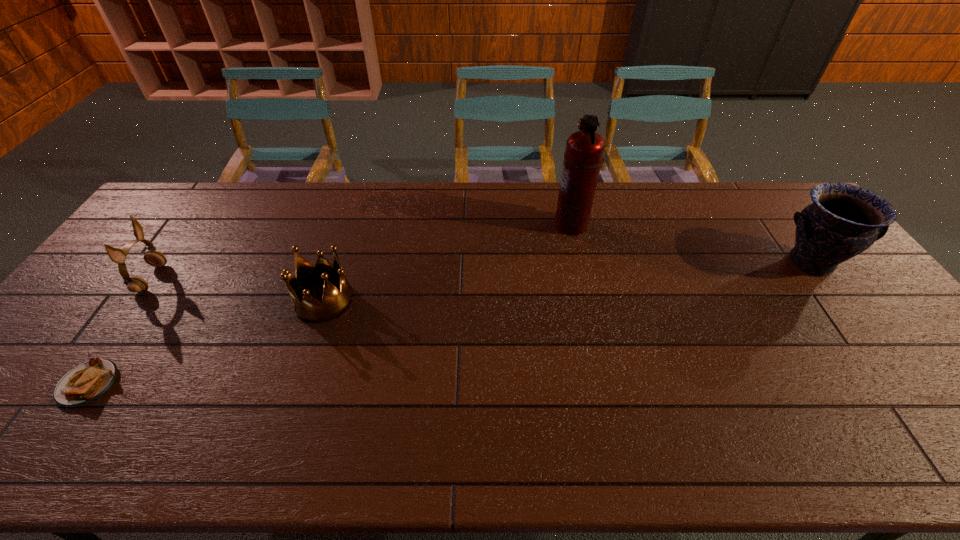
Identify the location of vacant space positioned 0.300m on the nozzle side of the fourth object from left to right. The height and width of the screenshot is (540, 960). (464, 225).

The height and width of the screenshot is (540, 960). What are the coordinates of `free location located 0.140m on the nozzle side of the fourth object from left to right` in the screenshot? It's located at (512, 225).

Locate an element on the screen. The height and width of the screenshot is (540, 960). vacant point located on the front handle of the pottery is located at coordinates (842, 305).

In order to click on vacant space located 0.090m on the front-facing side of the earphone in this screenshot , I will do `click(193, 278)`.

You are a GUI agent. You are given a task and a screenshot of the screen. Output one action in this format:
    pyautogui.click(x=<x>, y=<y>)
    Task: Click on the vacant space located on the front of the third object from left to right
    
    Given the screenshot: What is the action you would take?
    pyautogui.click(x=272, y=459)

What are the coordinates of `free space located on the back of the nearest object` in the screenshot? It's located at (145, 303).

At what (x,y) coordinates should I click in order to perform the action: click on object located in the far edge section of the desktop. Please return your answer as a coordinate pair (x, y). The width and height of the screenshot is (960, 540). Looking at the image, I should click on (583, 156).

Locate an element on the screen. This screenshot has width=960, height=540. earphone that is at the left edge is located at coordinates (135, 284).

Find the location of a particular element. The width and height of the screenshot is (960, 540). sandwich located at the left edge is located at coordinates (87, 382).

The image size is (960, 540). I want to click on object that is at the right edge, so click(x=844, y=220).